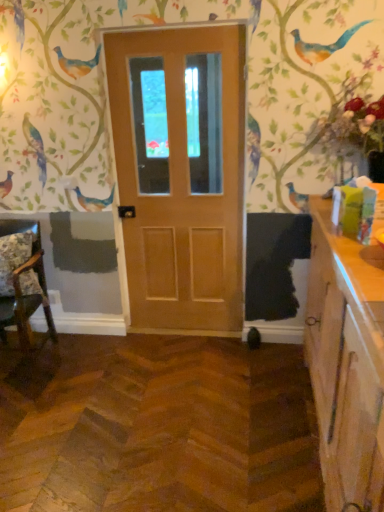
Question: Can you confirm if matte wood door at center is positioned to the right of wooden cabinet at right?

Choices:
 (A) no
 (B) yes

Answer: (A)

Question: Is matte wood door at center taller than wooden cabinet at right?

Choices:
 (A) no
 (B) yes

Answer: (B)

Question: Is matte wood door at center facing away from wooden cabinet at right?

Choices:
 (A) no
 (B) yes

Answer: (A)

Question: Is matte wood door at center placed right next to wooden cabinet at right?

Choices:
 (A) no
 (B) yes

Answer: (A)

Question: Is matte wood door at center aimed at wooden cabinet at right?

Choices:
 (A) yes
 (B) no

Answer: (B)

Question: Can you confirm if matte wood door at center is smaller than wooden cabinet at right?

Choices:
 (A) yes
 (B) no

Answer: (A)

Question: Is wooden cabinet at right thinner than matte wood door at center?

Choices:
 (A) no
 (B) yes

Answer: (A)

Question: Is wooden cabinet at right oriented away from matte wood door at center?

Choices:
 (A) no
 (B) yes

Answer: (A)

Question: From the image's perspective, is wooden cabinet at right above matte wood door at center?

Choices:
 (A) yes
 (B) no

Answer: (B)

Question: Is matte wood door at center completely or partially inside wooden cabinet at right?

Choices:
 (A) yes
 (B) no

Answer: (B)

Question: Is wooden cabinet at right to the right of matte wood door at center from the viewer's perspective?

Choices:
 (A) yes
 (B) no

Answer: (A)

Question: Could you tell me if wooden cabinet at right is facing matte wood door at center?

Choices:
 (A) no
 (B) yes

Answer: (B)

Question: Is fluffy floral pillow at left wider than wooden floral-patterned chair at left?

Choices:
 (A) no
 (B) yes

Answer: (A)